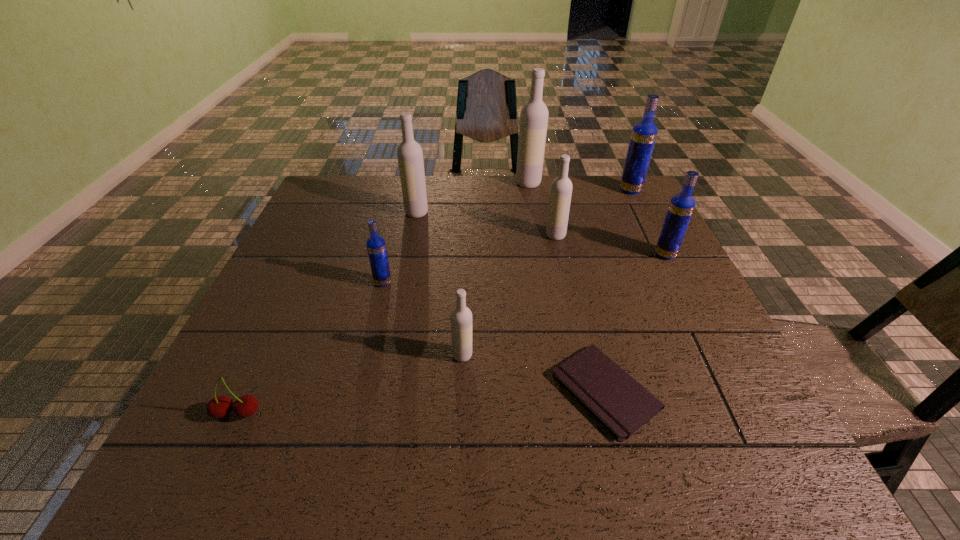
This screenshot has height=540, width=960. What are the coordinates of `blank area located on the back of the fifth farthest vodka` in the screenshot? It's located at (649, 223).

At what (x,y) coordinates should I click in order to perform the action: click on free point located on the back of the second nearest vodka. Please return your answer as a coordinate pair (x, y). The width and height of the screenshot is (960, 540). Looking at the image, I should click on (402, 206).

The height and width of the screenshot is (540, 960). Identify the location of free space located on the right of the third white vodka from right to left. (602, 355).

Find the location of a particular element. This screenshot has height=540, width=960. vacant space situated 0.070m on the surface of the eighth tallest object is located at coordinates [x=215, y=461].

Identify the location of free space located on the left of the checkbook. (416, 391).

Where is `object that is at the near edge`? The width and height of the screenshot is (960, 540). object that is at the near edge is located at coordinates (622, 405).

At what (x,y) coordinates should I click in order to perform the action: click on object located at the left edge. Please return your answer as a coordinate pair (x, y). The image size is (960, 540). Looking at the image, I should click on (245, 406).

Where is `object situated at the far right corner`? object situated at the far right corner is located at coordinates (644, 133).

Where is `blank area at the far edge`? This screenshot has width=960, height=540. blank area at the far edge is located at coordinates (381, 201).

The height and width of the screenshot is (540, 960). What are the coordinates of `vacant space at the near edge` in the screenshot? It's located at (308, 456).